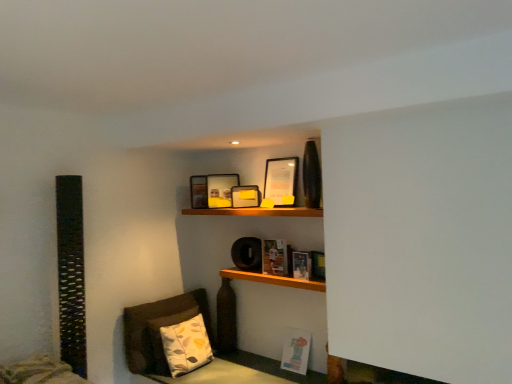
This screenshot has height=384, width=512. I want to click on vacant space in matte paper book at center, the 1th book viewed from the top (from a real-world perspective), so click(278, 274).